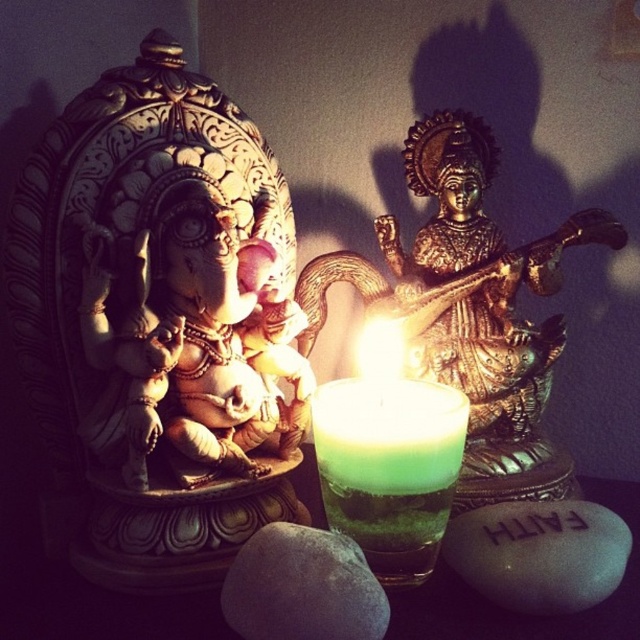
Question: Among these objects, which one is farthest from the camera?

Choices:
 (A) gray matte rock at center
 (B) green wax candle at center

Answer: (B)

Question: Can you confirm if green wax candle at center is positioned to the right of white smooth stone at center?

Choices:
 (A) no
 (B) yes

Answer: (A)

Question: Which is farther from the green wax candle at center?

Choices:
 (A) gray matte rock at center
 (B) white smooth stone at center

Answer: (B)

Question: Is white smooth stone at center below gray matte rock at center?

Choices:
 (A) no
 (B) yes

Answer: (A)

Question: Which object appears farthest from the camera in this image?

Choices:
 (A) gray matte rock at center
 (B) white smooth stone at center
 (C) green wax candle at center

Answer: (B)

Question: Is white smooth stone at center above gray matte rock at center?

Choices:
 (A) yes
 (B) no

Answer: (A)